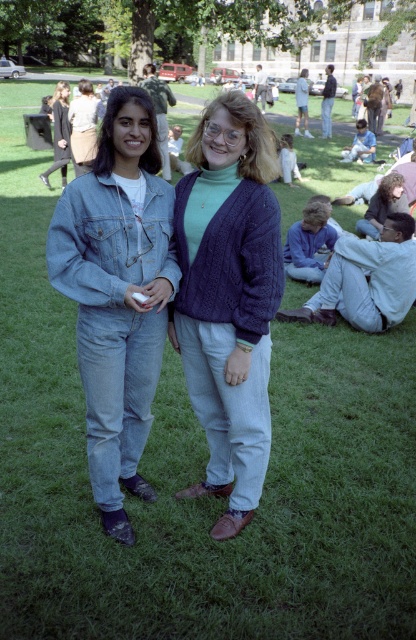
Does knitted purple sweater at center appear under denim jumpsuit at left?

Yes.

Is point (250, 442) positioned after point (54, 129)?

No, it is in front of (54, 129).

Identify the location of knitted purple sweater at center. (228, 298).

Which is in front, point (274, 220) or point (165, 189)?

Positioned in front is point (274, 220).

Between knitted purple sweater at center and denim jacket at center, which one has less height?

With less height is knitted purple sweater at center.

Between point (215, 394) and point (98, 442), which one is positioned in front?

Positioned in front is point (98, 442).

Where is `knitted purple sweater at center`? The image size is (416, 640). knitted purple sweater at center is located at coordinates (228, 298).

Who is shorter, denim jacket at center or denim jumpsuit at left?

With less height is denim jacket at center.

Measure the distance between denim jacket at center and camera.

denim jacket at center and camera are 8.42 feet apart from each other.

Which is in front, point (141, 244) or point (59, 145)?

Positioned in front is point (141, 244).

This screenshot has height=640, width=416. Find the location of `denim jacket at center`. denim jacket at center is located at coordinates (118, 294).